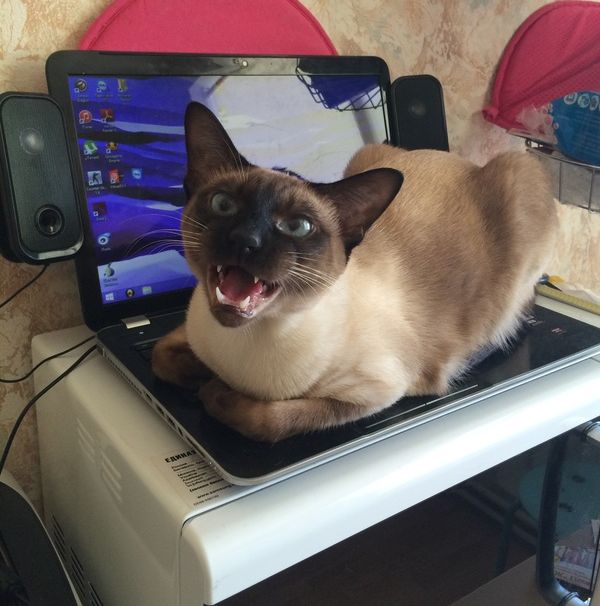
Identify the location of wall. This screenshot has height=606, width=600. (456, 22), (63, 22).